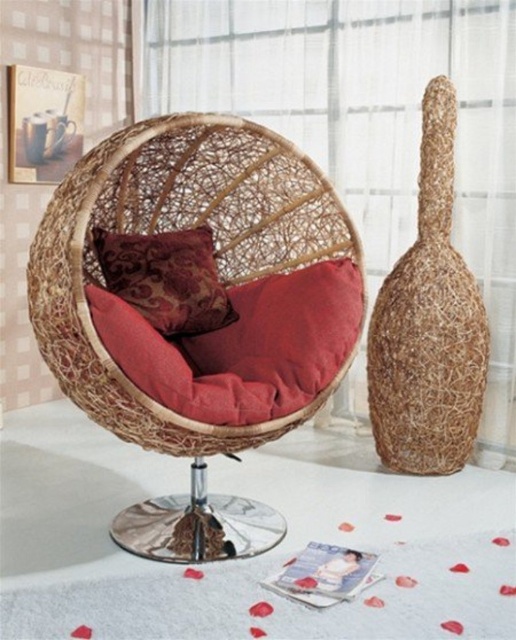
Where is the woven rattan armchair at center located in the image?

The woven rattan armchair at center is located at point (x=197, y=308).